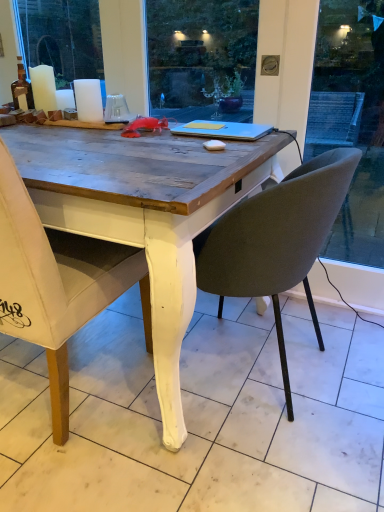
Question: From a real-world perspective, relative to white matte candle at upper left, arranged as the 2th candle when viewed from the left, is white matte candle at upper left, which ranks as the second candle in right-to-left order, vertically above or below?

Choices:
 (A) above
 (B) below

Answer: (A)

Question: From the image's perspective, is white matte candle at upper left, which ranks as the second candle in right-to-left order, positioned above or below white matte candle at upper left, acting as the 1th candle starting from the right?

Choices:
 (A) below
 (B) above

Answer: (B)

Question: Which of these objects is positioned farthest from the matte gray chair at center, acting as the first chair starting from the right?

Choices:
 (A) white painted wood leg at lower center
 (B) white matte candle at upper left, which ranks as the second candle in right-to-left order
 (C) white matte candle at upper left, arranged as the 2th candle when viewed from the left
 (D) blue matte laptop at center
 (E) white fabric chair at left, the 1th chair when ordered from left to right

Answer: (B)

Question: Which object is the closest to the white fabric chair at left, which is the second chair from right to left?

Choices:
 (A) blue matte laptop at center
 (B) white painted wood leg at lower center
 (C) matte gray chair at center, acting as the first chair starting from the right
 (D) white matte candle at upper left, arranged as the 2th candle when viewed from the left
 (E) white matte candle at upper left, which appears as the 1th candle when viewed from the left

Answer: (B)